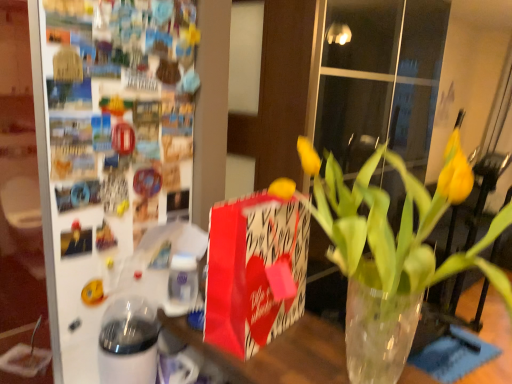
Question: From a real-world perspective, relative to translucent glass vase at center, is yellow matte vase at center vertically above or below?

Choices:
 (A) above
 (B) below

Answer: (A)

Question: Is point (430, 283) positioned closer to the camera than point (333, 329)?

Choices:
 (A) closer
 (B) farther

Answer: (A)

Question: Estimate the real-world distances between objects in this image. Which object is farther from the translucent glass vase at center?

Choices:
 (A) yellow matte vase at center
 (B) white glossy glass jar at lower left
 (C) red paper gift bag at center

Answer: (B)

Question: Considering the real-world distances, which object is closest to the translucent glass vase at center?

Choices:
 (A) red paper gift bag at center
 (B) yellow matte vase at center
 (C) white glossy glass jar at lower left

Answer: (B)